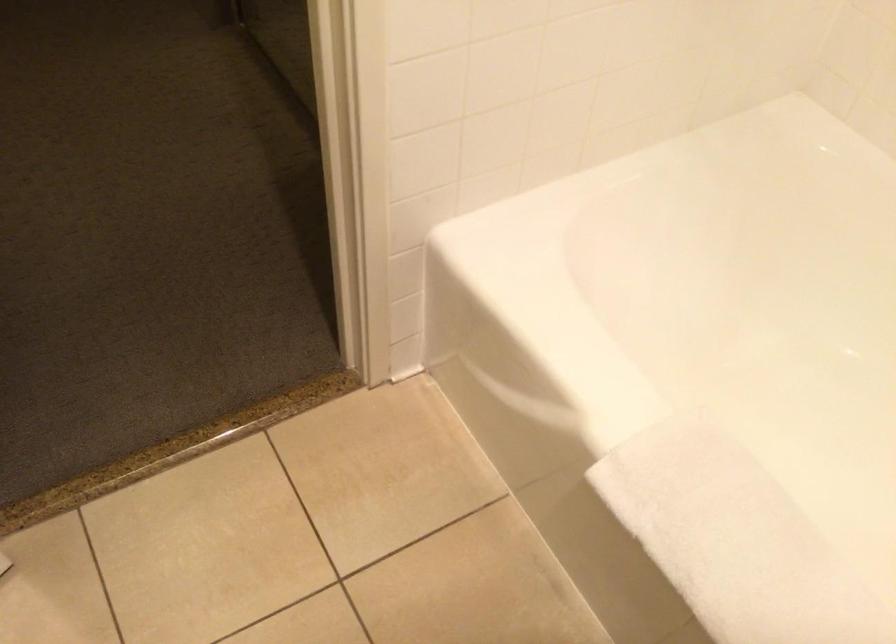
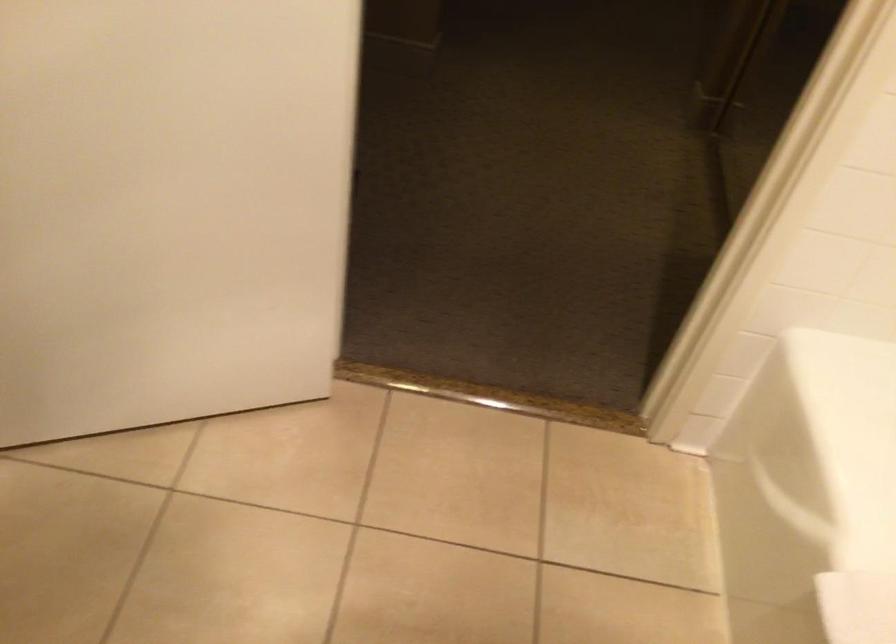
Question: The camera is either moving clockwise (left) or counter-clockwise (right) around the object. The first image is from the beginning of the video and the second image is from the end. Is the camera moving left or right when shooting the video?

Choices:
 (A) Left
 (B) Right

Answer: (B)